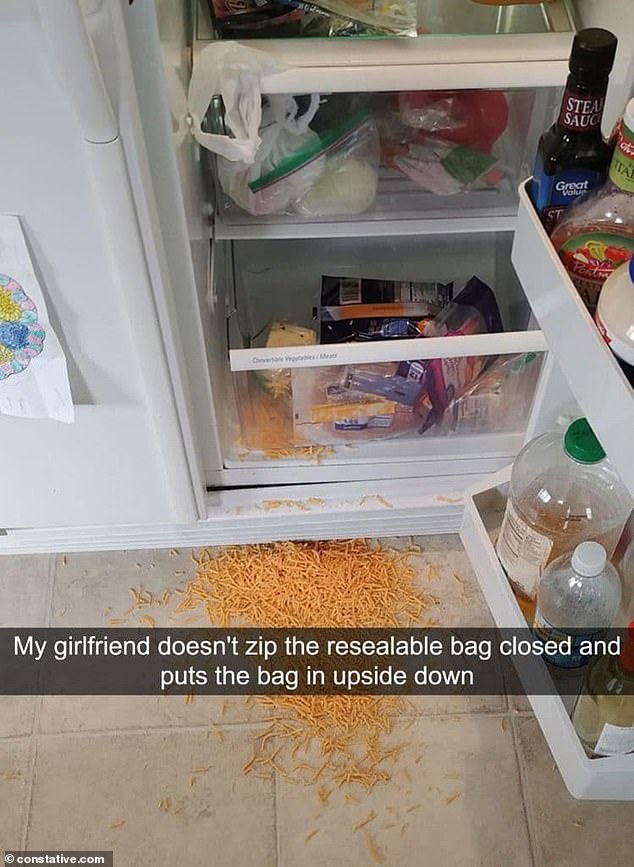
Locate an element on the screen. Image resolution: width=634 pixels, height=867 pixels. picture hanging on refrigerator is located at coordinates (36, 383).